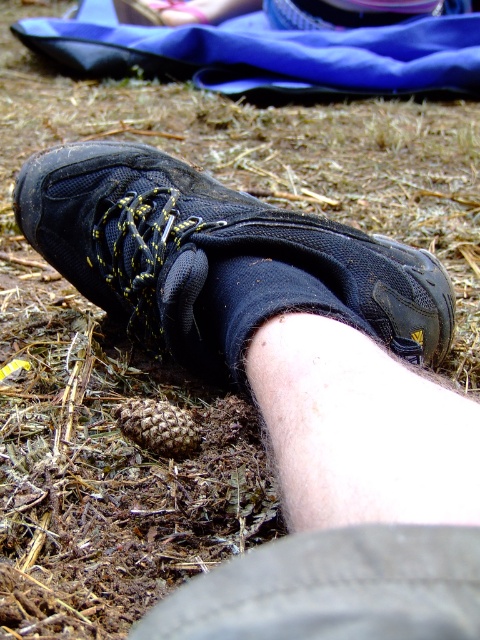
Based on the photo, you are a photographer trying to capture the exact location of the matte black shoe at lower left in the image. According to the coordinates provided, where is the shoe located?

The matte black shoe at lower left is located at point (x=217, y=259).

Consider the image. You are a photographer trying to capture the matte black shoe at lower left and the black fabric ankle at lower center in focus. Since you can only focus on one object at a time, which one should you choose to ensure it appears sharp in the photo?

The matte black shoe at lower left is above the black fabric ankle at lower center, so if you focus on the matte black shoe at lower left, it will be in focus while the black fabric ankle at lower center may appear slightly blurred. Alternatively, focusing on the black fabric ankle at lower center might make the shoe less sharp. Depending on which object you prioritize, but the spatial relationship indicates their distance from the camera.

You are a hiker who needs to know if your shoe will cover your ankle to protect it from rough terrain. Based on the image, does the matte black shoe at lower left completely cover the black fabric ankle at lower center?

The matte black shoe at lower left is wider than the black fabric ankle at lower center, so it should cover the ankle sufficiently to protect it from rough terrain.